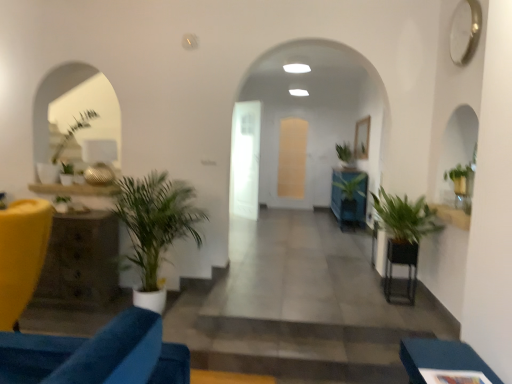
Identify the location of green glossy plant at center, marked as the 2th houseplant in a back-to-front arrangement. (349, 197).

This screenshot has width=512, height=384. What do you see at coordinates (66, 173) in the screenshot?
I see `green leafy plant at left, the 3th houseplant positioned from the back` at bounding box center [66, 173].

What do you see at coordinates (21, 255) in the screenshot? I see `matte yellow chair at left, the 2th furniture viewed from the right` at bounding box center [21, 255].

The image size is (512, 384). I want to click on green glossy plant at center, marked as the fifth houseplant in a left-to-right arrangement, so click(349, 197).

Which is closer to the camera, (x=245, y=146) or (x=56, y=152)?

Point (x=245, y=146) appears to be farther away from the viewer than point (x=56, y=152).

Is transparent glass door at center, which is the 1th glass door in front-to-back order, shorter than green leafy plant at left, marked as the 3th houseplant in a front-to-back arrangement?

No.

Is transparent glass door at center, which is the 1th glass door in front-to-back order, in front of or behind green leafy plant at left, which is counted as the 1th houseplant, starting from the left, in the image?

Visually, transparent glass door at center, which is the 1th glass door in front-to-back order, is located behind green leafy plant at left, which is counted as the 1th houseplant, starting from the left.

Is transparent glass door at center, the second glass door in the right-to-left sequence, oriented towards green leafy plant at left, marked as the 3th houseplant in a front-to-back arrangement?

No, transparent glass door at center, the second glass door in the right-to-left sequence, is not facing towards green leafy plant at left, marked as the 3th houseplant in a front-to-back arrangement.

Which object is closer to the camera taking this photo, green leafy plant at center or green glossy plant at center, marked as the 2th houseplant in a back-to-front arrangement?

green leafy plant at center is in front.

Which of these two, green leafy plant at center or green glossy plant at center, positioned as the fifth houseplant in front-to-back order, stands shorter?

green leafy plant at center is shorter.

Measure the distance from green leafy plant at center to green glossy plant at center, marked as the fifth houseplant in a left-to-right arrangement.

green leafy plant at center and green glossy plant at center, marked as the fifth houseplant in a left-to-right arrangement, are 4.33 inches apart from each other.

Which of these two, green leafy plant at center or green glossy plant at center, marked as the fifth houseplant in a left-to-right arrangement, is smaller?

green leafy plant at center is smaller.

How many degrees apart are the facing directions of matte yellow chair at left, the 2th furniture viewed from the right, and black metal table at lower right, placed as the first table when sorted from right to left?

25.4 degrees.

Is matte yellow chair at left, the second furniture from the front, with black metal table at lower right, the first table when ordered from front to back?

No, matte yellow chair at left, the second furniture from the front, is not beside black metal table at lower right, the first table when ordered from front to back.

Can black metal table at lower right, which ranks as the 2th table in back-to-front order, be found inside matte yellow chair at left, positioned as the first furniture in back-to-front order?

That's incorrect, black metal table at lower right, which ranks as the 2th table in back-to-front order, is not inside matte yellow chair at left, positioned as the first furniture in back-to-front order.

In the scene shown: From a real-world perspective, is matte yellow chair at left, positioned as the first furniture in back-to-front order, physically above black metal table at lower right, which ranks as the 2th table in back-to-front order?

Correct, in the physical world, matte yellow chair at left, positioned as the first furniture in back-to-front order, is higher than black metal table at lower right, which ranks as the 2th table in back-to-front order.

Which is behind, point (492, 377) or point (292, 157)?

The point (292, 157) is farther from the camera.

Is blue fabric ottoman at lower right, which ranks as the 2th furniture in left-to-right order, situated inside translucent glass door at center, acting as the 1th glass door starting from the back, or outside?

blue fabric ottoman at lower right, which ranks as the 2th furniture in left-to-right order, is located beyond the bounds of translucent glass door at center, acting as the 1th glass door starting from the back.

Considering the relative positions of blue fabric ottoman at lower right, positioned as the first furniture in front-to-back order, and translucent glass door at center, the first glass door viewed from the right, in the image provided, is blue fabric ottoman at lower right, positioned as the first furniture in front-to-back order, in front of translucent glass door at center, the first glass door viewed from the right,?

That is True.

Starting from the translucent glass door at center, acting as the 1th glass door starting from the back, which furniture is the 2nd one in front? Please provide its 2D coordinates.

[(441, 358)]

From a real-world perspective, is green matte plant at left, the first houseplant in the front-to-back sequence, below green leafy plant at right, the 2th houseplant in the front-to-back sequence?

Yes, from a real-world perspective, green matte plant at left, the first houseplant in the front-to-back sequence, is beneath green leafy plant at right, the 2th houseplant in the front-to-back sequence.

Is green matte plant at left, the first houseplant in the front-to-back sequence, positioned with its back to green leafy plant at right, the 2th houseplant in the front-to-back sequence?

No, green matte plant at left, the first houseplant in the front-to-back sequence, is not facing away from green leafy plant at right, the 2th houseplant in the front-to-back sequence.

Does green matte plant at left, the 4th houseplant viewed from the right, contain green leafy plant at right, acting as the 4th houseplant starting from the left?

No, green leafy plant at right, acting as the 4th houseplant starting from the left, is not inside green matte plant at left, the 4th houseplant viewed from the right.

Does green matte plant at left, the 6th houseplant from the back, have a larger size compared to green leafy plant at right, the 2th houseplant in the front-to-back sequence?

Yes, green matte plant at left, the 6th houseplant from the back, is bigger than green leafy plant at right, the 2th houseplant in the front-to-back sequence.

From the picture: Does matte yellow chair at left, the 2th furniture viewed from the right, contain translucent glass door at center, the first glass door viewed from the right?

Actually, translucent glass door at center, the first glass door viewed from the right, is outside matte yellow chair at left, the 2th furniture viewed from the right.

Looking at their sizes, would you say matte yellow chair at left, the 2th furniture viewed from the right, is wider or thinner than translucent glass door at center, placed as the second glass door when sorted from left to right?

Clearly, matte yellow chair at left, the 2th furniture viewed from the right, has more width compared to translucent glass door at center, placed as the second glass door when sorted from left to right.

In the scene shown: Is the position of matte yellow chair at left, the second furniture from the front, less distant than that of translucent glass door at center, placed as the second glass door when sorted from left to right?

Yes, it is in front of translucent glass door at center, placed as the second glass door when sorted from left to right.

Is point (109, 235) in front of point (75, 122)?

Yes, it is.

Considering the relative sizes of rustic wood side table at left, which appears as the first table when viewed from the left, and green leafy plant at left, which is counted as the 1th houseplant, starting from the left, in the image provided, is rustic wood side table at left, which appears as the first table when viewed from the left, thinner than green leafy plant at left, which is counted as the 1th houseplant, starting from the left,?

No, rustic wood side table at left, which appears as the first table when viewed from the left, is not thinner than green leafy plant at left, which is counted as the 1th houseplant, starting from the left.

Is rustic wood side table at left, which appears as the first table when viewed from the left, positioned with its back to green leafy plant at left, which is counted as the 1th houseplant, starting from the left?

No, green leafy plant at left, which is counted as the 1th houseplant, starting from the left, is not at the back of rustic wood side table at left, which appears as the first table when viewed from the left.

At what (x,y) coordinates should I click in order to perform the action: click on glass door that is the 1st one when counting backward from the green leafy plant at left, the 4th houseplant positioned from the back. Please return your answer as a coordinate pair (x, y). This screenshot has height=384, width=512. Looking at the image, I should click on (245, 159).

What are the coordinates of `the 1st houseplant to the right of the green leafy plant at center, starting your count from the anchor` in the screenshot? It's located at (349, 197).

Considering their positions, is green matte plant at left, acting as the third houseplant starting from the left, positioned further to rustic wood side table at left, which appears as the first table when viewed from the back, than green leafy plant at center, the 1th houseplant viewed from the back?

green leafy plant at center, the 1th houseplant viewed from the back.

Which object lies nearer to the anchor point matte yellow chair at left, the 2th furniture viewed from the right, translucent glass door at center, the 2th glass door from the front, or green glossy plant at center, marked as the 2th houseplant in a back-to-front arrangement?

green glossy plant at center, marked as the 2th houseplant in a back-to-front arrangement, is closer to matte yellow chair at left, the 2th furniture viewed from the right.

Considering their positions, is translucent glass door at center, acting as the 1th glass door starting from the back, positioned further to green leafy plant at center, the sixth houseplant from the front, than black metal table at lower right, acting as the 2th table starting from the left?

The object further to green leafy plant at center, the sixth houseplant from the front, is black metal table at lower right, acting as the 2th table starting from the left.

From the image, which object appears to be farther from black metal table at lower right, acting as the 2th table starting from the left, green leafy plant at left, marked as the 3th houseplant in a front-to-back arrangement, or green glossy plant at center, marked as the fifth houseplant in a left-to-right arrangement?

The object further to black metal table at lower right, acting as the 2th table starting from the left, is green leafy plant at left, marked as the 3th houseplant in a front-to-back arrangement.

Considering their positions, is matte yellow chair at left, positioned as the first furniture in back-to-front order, positioned further to green matte plant at left, the first houseplant in the front-to-back sequence, than green leafy plant at right, marked as the third houseplant in a right-to-left arrangement?

Based on the image, green leafy plant at right, marked as the third houseplant in a right-to-left arrangement, appears to be further to green matte plant at left, the first houseplant in the front-to-back sequence.

Looking at the image, which one is located closer to blue fabric ottoman at lower right, which appears as the first furniture when viewed from the right, green leafy plant at left, marked as the 3th houseplant in a front-to-back arrangement, or rustic wood side table at left, which is the second table in front-to-back order?

rustic wood side table at left, which is the second table in front-to-back order, is closer to blue fabric ottoman at lower right, which appears as the first furniture when viewed from the right.

Which object lies further to the anchor point black metal table at lower right, the first table when ordered from front to back, green leafy plant at center, the 1th houseplant viewed from the back, or green matte plant at left, the 6th houseplant from the back?

green leafy plant at center, the 1th houseplant viewed from the back, lies further to black metal table at lower right, the first table when ordered from front to back, than the other object.

From the image, which object appears to be nearer to green leafy plant at center, the 1th houseplant viewed from the back, black metal table at lower right, acting as the 2th table starting from the left, or green glossy plant at center, positioned as the fifth houseplant in front-to-back order?

The object closer to green leafy plant at center, the 1th houseplant viewed from the back, is green glossy plant at center, positioned as the fifth houseplant in front-to-back order.

Find the location of a particular element. furniture between green matte plant at left, the 4th houseplant viewed from the right, and green leafy plant at right, marked as the third houseplant in a right-to-left arrangement, from left to right is located at coordinates (441, 358).

This screenshot has height=384, width=512. Identify the location of table between green leafy plant at left, marked as the 3th houseplant in a front-to-back arrangement, and green glossy plant at center, positioned as the fifth houseplant in front-to-back order. (401, 264).

Identify the location of glass door between green leafy plant at left, which is counted as the 5th houseplant, starting from the right, and green leafy plant at center, the sixth houseplant from the front, in the front-back direction. The image size is (512, 384). (245, 159).

Image resolution: width=512 pixels, height=384 pixels. What are the coordinates of `plant between rustic wood side table at left, placed as the second table when sorted from right to left, and translucent glass door at center, the first glass door viewed from the right, along the z-axis` in the screenshot? It's located at (x=350, y=186).